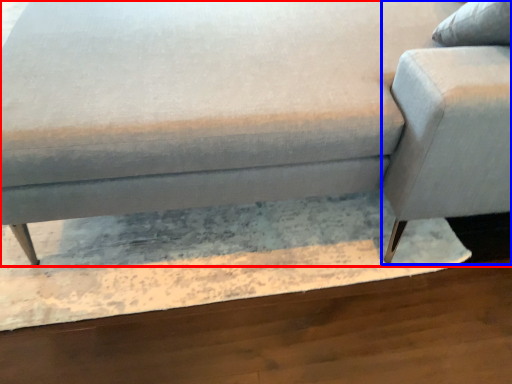
Question: Which point is closer to the camera, studio couch (highlighted by a red box) or swivel chair (highlighted by a blue box)?

Choices:
 (A) studio couch
 (B) swivel chair

Answer: (A)